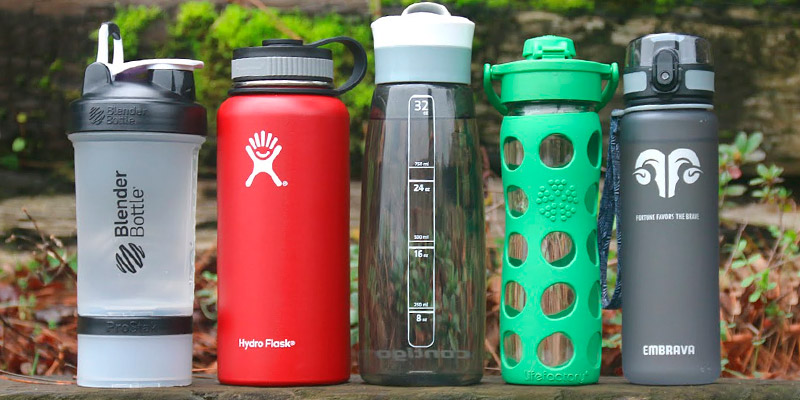
The width and height of the screenshot is (800, 400). I want to click on bottles, so click(x=145, y=240), click(x=262, y=221), click(x=397, y=220), click(x=538, y=205), click(x=684, y=208).